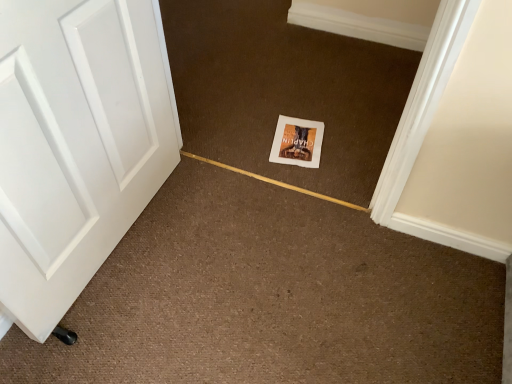
Question: Based on their sizes in the image, would you say white paper postcard at center is bigger or smaller than white matte book at center?

Choices:
 (A) small
 (B) big

Answer: (A)

Question: Considering the positions of white paper postcard at center and white matte book at center in the image, is white paper postcard at center taller or shorter than white matte book at center?

Choices:
 (A) tall
 (B) short

Answer: (B)

Question: Considering the positions of white paper postcard at center and white matte book at center in the image, is white paper postcard at center wider or thinner than white matte book at center?

Choices:
 (A) thin
 (B) wide

Answer: (A)

Question: Choose the correct answer: Is white matte book at center inside white paper postcard at center or outside it?

Choices:
 (A) inside
 (B) outside

Answer: (B)

Question: Considering the positions of white matte book at center and white paper postcard at center in the image, is white matte book at center wider or thinner than white paper postcard at center?

Choices:
 (A) thin
 (B) wide

Answer: (B)

Question: From a real-world perspective, relative to white paper postcard at center, is white matte book at center vertically above or below?

Choices:
 (A) below
 (B) above

Answer: (B)

Question: Is point (310, 99) positioned closer to the camera than point (284, 120)?

Choices:
 (A) farther
 (B) closer

Answer: (A)